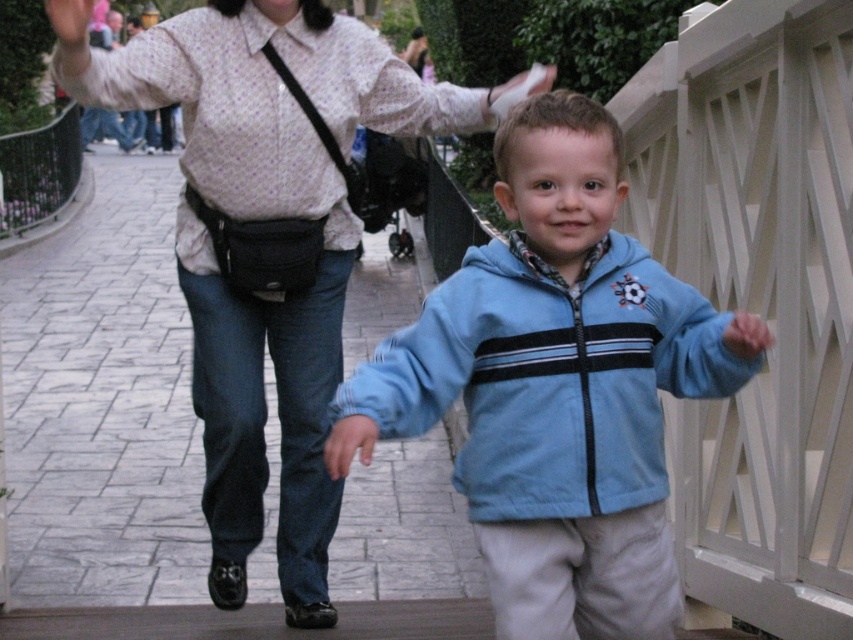
Question: Which of the following is the farthest from the observer?

Choices:
 (A) light blue fleece jacket at center
 (B) matte white blouse at center

Answer: (B)

Question: Can you confirm if light blue fleece jacket at center is positioned above matte white blouse at center?

Choices:
 (A) yes
 (B) no

Answer: (B)

Question: Does light blue fleece jacket at center lie in front of matte white blouse at center?

Choices:
 (A) no
 (B) yes

Answer: (B)

Question: From the image, what is the correct spatial relationship of light blue fleece jacket at center in relation to matte white blouse at center?

Choices:
 (A) above
 (B) below

Answer: (B)